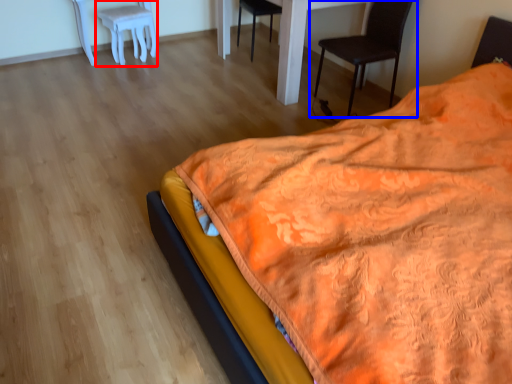
Question: Which of the following is the farthest to the observer, stool (highlighted by a red box) or chair (highlighted by a blue box)?

Choices:
 (A) stool
 (B) chair

Answer: (A)